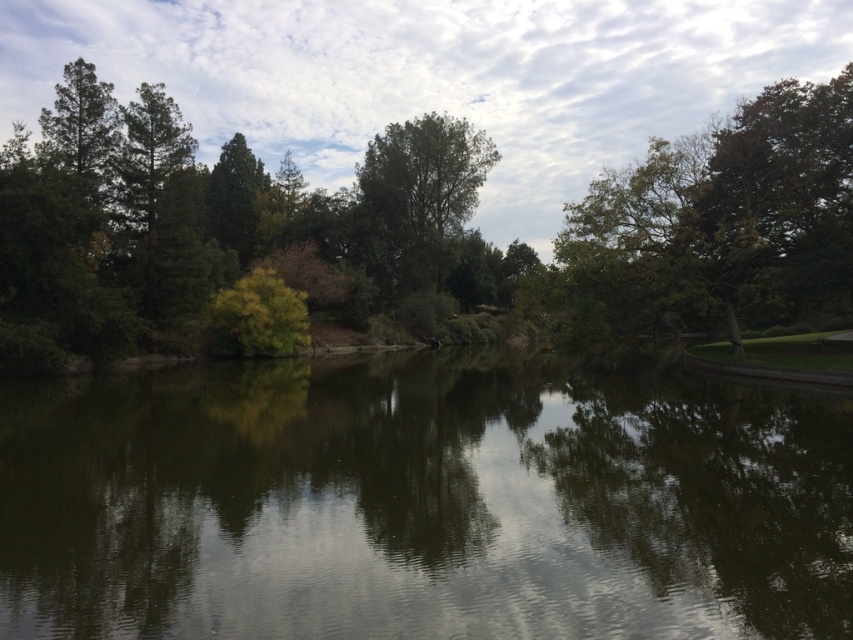
Which is behind, point (780, 292) or point (370, 173)?

The point (370, 173) is more distant.

Who is positioned more to the right, green leafy tree at right or green leafy tree at center?

green leafy tree at right is more to the right.

Does point (601, 218) lie behind point (466, 212)?

No, (601, 218) is in front of (466, 212).

Identify the location of green leafy tree at right. (722, 220).

Does green matte tree at center appear under green leafy tree at center?

No.

Where is `green matte tree at center`? green matte tree at center is located at coordinates (409, 225).

Does green reflective water at center have a lesser height compared to green leafy tree at center?

Indeed, green reflective water at center has a lesser height compared to green leafy tree at center.

In the scene shown: Is green reflective water at center positioned in front of green leafy tree at center?

Yes.

Between point (328, 422) and point (412, 150), which one is positioned behind?

Positioned behind is point (412, 150).

I want to click on green reflective water at center, so click(x=422, y=502).